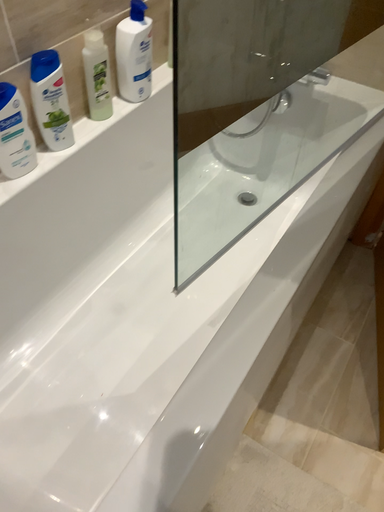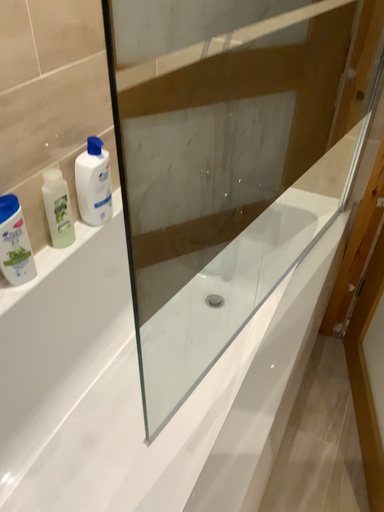
Question: How did the camera likely rotate when shooting the video?

Choices:
 (A) rotated upward
 (B) rotated downward

Answer: (A)